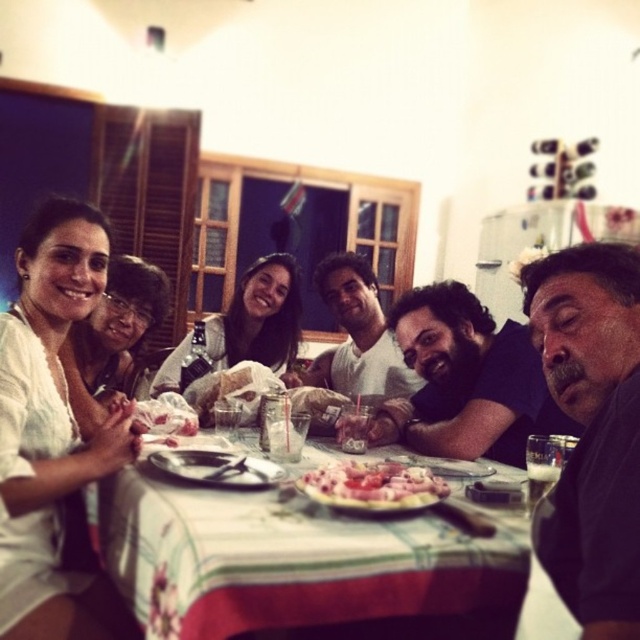
You are a photographer trying to capture a candid shot of the dark gray shirt at right and the pinkish glossy meat at center. Since you want to ensure both subjects are in focus, you need to know their height difference. Which object is taller?

The dark gray shirt at right is much taller as the pinkish glossy meat at center.

You are a server who needs to place a new dish on the table. The table has a white printed tablecloth at center and a pinkish glossy meat at center. Which object has a larger width that you should consider for placing the dish?

The white printed tablecloth at center has a larger width than the pinkish glossy meat at center, so you should consider placing the dish on the tablecloth area since it provides more space.